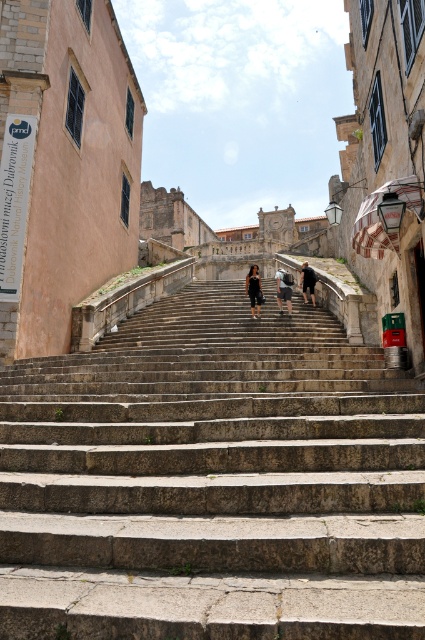
Can you confirm if dark blue jeans at center is shorter than dark gray stone stairs at center?

Yes.

Can you confirm if dark blue jeans at center is positioned below dark gray stone stairs at center?

Correct, dark blue jeans at center is located below dark gray stone stairs at center.

Who is more forward, (x=289, y=289) or (x=308, y=269)?

Point (x=289, y=289) is more forward.

You are a GUI agent. You are given a task and a screenshot of the screen. Output one action in this format:
    pyautogui.click(x=<x>, y=<y>)
    Task: Click on the dark blue jeans at center
    The height and width of the screenshot is (640, 425).
    Given the screenshot: What is the action you would take?
    pyautogui.click(x=283, y=291)

From the picture: Between stone steps at center and dark gray stone figure at center, which one is positioned higher?

dark gray stone figure at center

The height and width of the screenshot is (640, 425). What are the coordinates of `stone steps at center` in the screenshot? It's located at (212, 481).

Is point (399, 538) closer to viewer compared to point (288, 304)?

That is True.

Does stone steps at center come in front of dark blue jeans at center?

Yes, it is in front of dark blue jeans at center.

Measure the distance between point (x=326, y=344) and camera.

36.86 feet

Locate an element on the screen. stone steps at center is located at coordinates (212, 481).